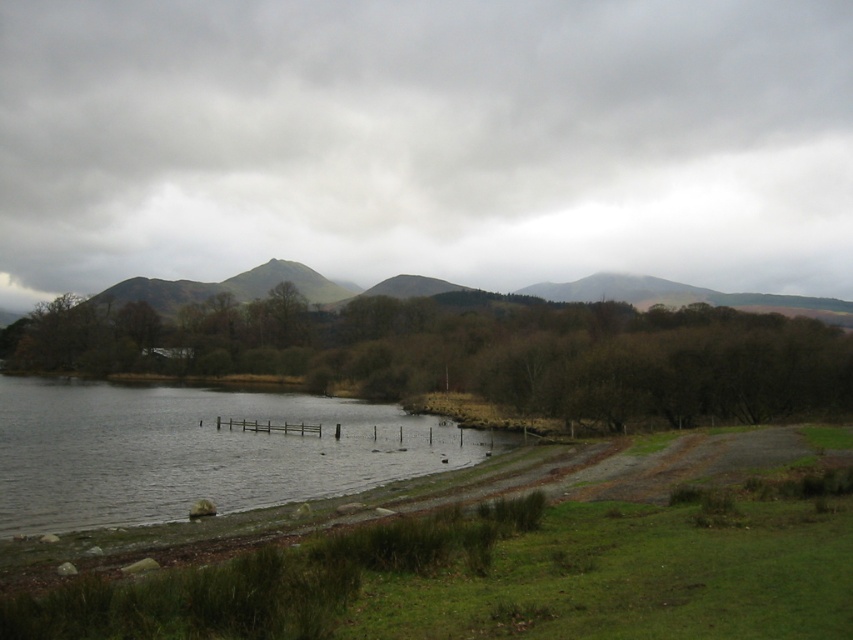
Question: Which of the following is the closest to the observer?

Choices:
 (A) (155, 472)
 (B) (705, 294)

Answer: (A)

Question: Does grayish water at lower left appear under green mossy hill at upper center?

Choices:
 (A) yes
 (B) no

Answer: (A)

Question: Can you confirm if grayish water at lower left is wider than green mossy hill at upper center?

Choices:
 (A) no
 (B) yes

Answer: (A)

Question: Which object is farther from the camera taking this photo?

Choices:
 (A) grayish water at lower left
 (B) green mossy hill at upper center

Answer: (B)

Question: Does grayish water at lower left have a greater width compared to green mossy hill at upper center?

Choices:
 (A) yes
 (B) no

Answer: (B)